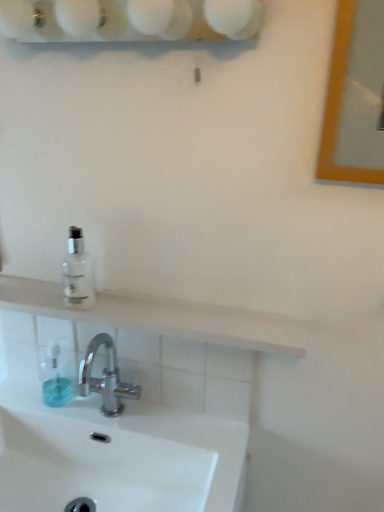
What are the coordinates of `free location to the left of transparent glass bottle at upper left` in the screenshot? It's located at (36, 291).